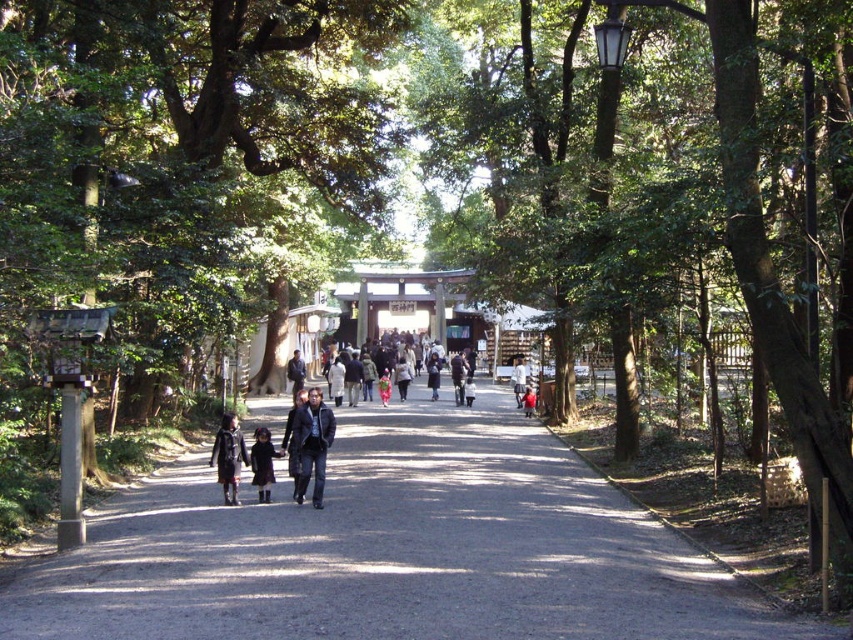
Is dark purple wool coat at center taller than floral fabric dress at center?

Indeed, dark purple wool coat at center has a greater height compared to floral fabric dress at center.

Is point (257, 442) farther from camera compared to point (386, 403)?

No, it is not.

Locate an element on the screen. This screenshot has width=853, height=640. dark purple wool coat at center is located at coordinates (262, 464).

Can you confirm if dark brown leather coat at center is shorter than light brown leather jacket at center?

Correct, dark brown leather coat at center is not as tall as light brown leather jacket at center.

What do you see at coordinates (228, 456) in the screenshot? Image resolution: width=853 pixels, height=640 pixels. I see `dark brown leather coat at center` at bounding box center [228, 456].

Does point (242, 454) come closer to viewer compared to point (526, 385)?

That is True.

This screenshot has width=853, height=640. What are the coordinates of `dark brown leather coat at center` in the screenshot? It's located at (228, 456).

Does dirt path at center lie behind floral fabric dress at center?

No, it is not.

Is dirt path at center to the right of floral fabric dress at center from the viewer's perspective?

Yes, dirt path at center is to the right of floral fabric dress at center.

Find the location of a particular element. dirt path at center is located at coordinates (393, 548).